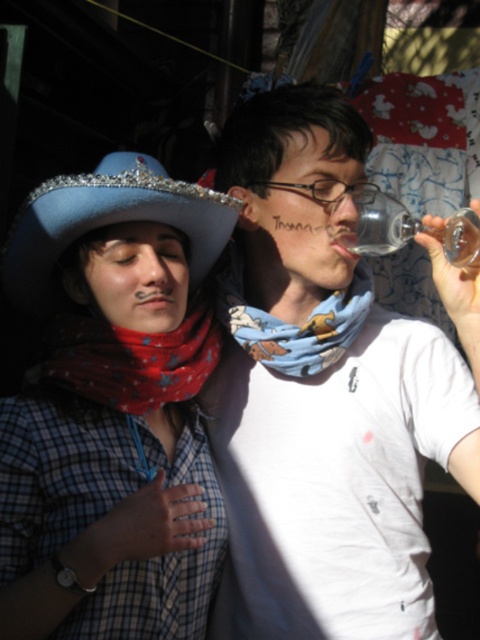
Based on the photo, you are standing in a festive outdoor setting with two people. You notice a point at coordinates (112, 410). Based on the scene description, what object is located at that point?

The point at coordinates (112, 410) indicates the blue felt hat at upper left.

You are organizing a costume party and need to decide which accessory to place on a narrow shelf. The printed cotton scarf at center and the blue bandana at center are both candidates. Given their widths, which one is more suitable for the shelf if the shelf can only accommodate the narrower item?

The blue bandana at center is narrower than the printed cotton scarf at center, so it is more suitable for the narrow shelf.